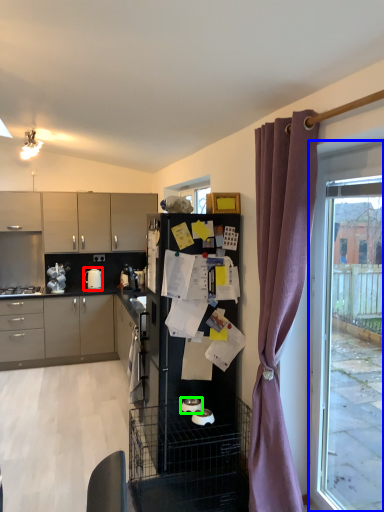
Question: Estimate the real-world distances between objects in this image. Which object is closer to kitchen appliance (highlighted by a red box), window (highlighted by a blue box) or appliance (highlighted by a green box)?

Choices:
 (A) window
 (B) appliance

Answer: (B)